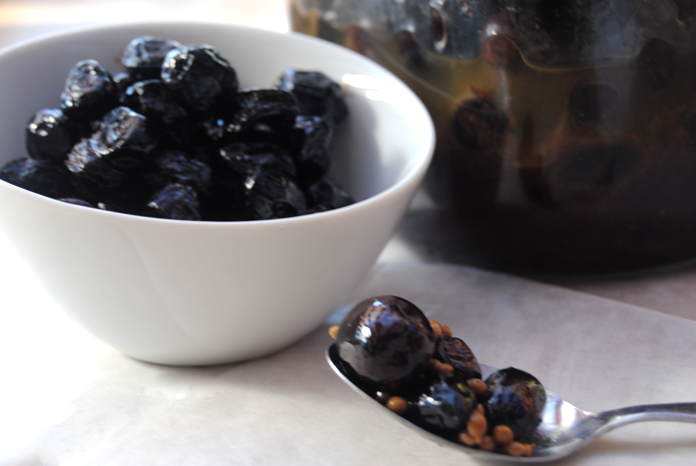
You are a GUI agent. You are given a task and a screenshot of the screen. Output one action in this format:
    pyautogui.click(x=<x>, y=<y>)
    Task: Click on the jar
    Image resolution: width=696 pixels, height=466 pixels.
    Given the screenshot: What is the action you would take?
    pyautogui.click(x=596, y=178)